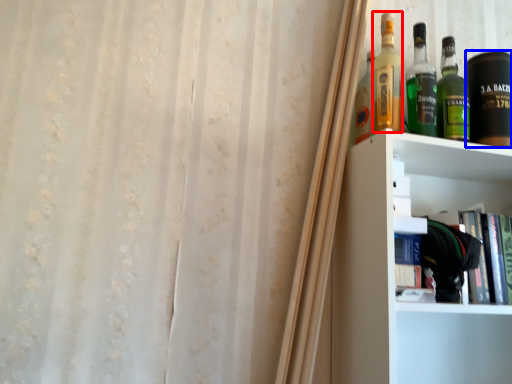
Question: Which of the following is the closest to the observer, bottle (highlighted by a red box) or beverage (highlighted by a blue box)?

Choices:
 (A) bottle
 (B) beverage

Answer: (A)